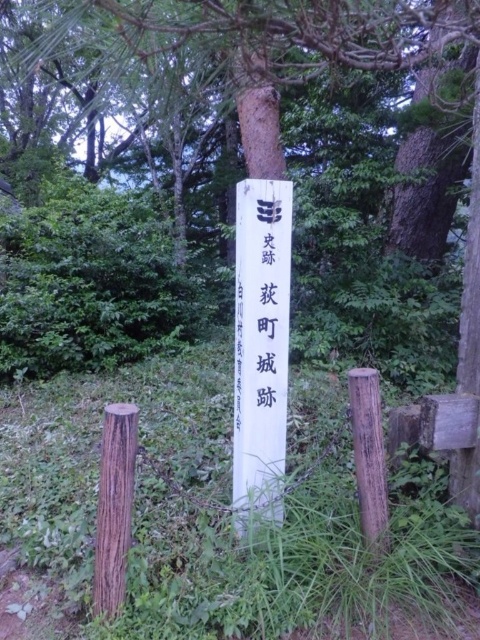
Is the position of white paper sign at center more distant than that of brown rough wooden post at center?

Yes, white paper sign at center is behind brown rough wooden post at center.

Measure the distance between white paper sign at center and camera.

A distance of 2.49 meters exists between white paper sign at center and camera.

The height and width of the screenshot is (640, 480). In order to click on white paper sign at center in this screenshot , I will do `click(261, 346)`.

Between white wood post at center and brown rough wooden post at center, which one has less height?

white wood post at center is shorter.

Is point (335, 168) closer to viewer compared to point (377, 524)?

No, it is not.

Find the location of a particular element. The image size is (480, 640). white wood post at center is located at coordinates (231, 173).

Is the position of brown wooden post at center more distant than that of brown rough wooden post at lower left?

Yes, it is behind brown rough wooden post at lower left.

Does brown wooden post at center have a lesser width compared to brown rough wooden post at lower left?

Incorrect, brown wooden post at center's width is not less than brown rough wooden post at lower left's.

Is point (301, 493) less distant than point (112, 486)?

No, it is behind (112, 486).

Image resolution: width=480 pixels, height=640 pixels. I want to click on brown wooden post at center, so click(x=276, y=528).